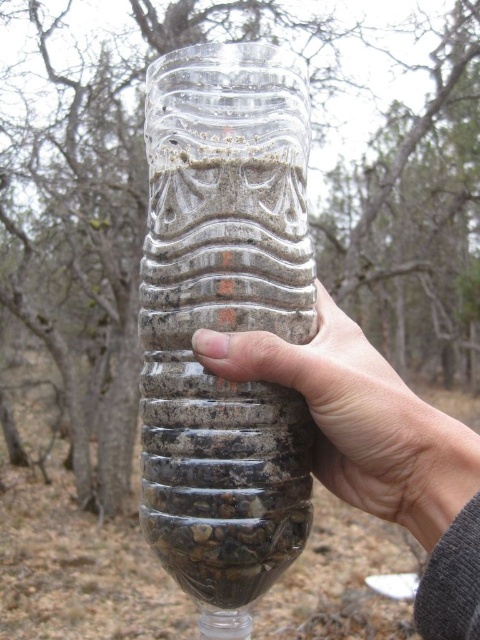
Question: Can you confirm if clear textured glass jar at center is wider than clear plastic bottle at center?

Choices:
 (A) no
 (B) yes

Answer: (A)

Question: In this image, where is clear textured glass jar at center located relative to clear plastic bottle at center?

Choices:
 (A) above
 (B) below

Answer: (A)

Question: Is clear textured glass jar at center closer to camera compared to clear plastic bottle at center?

Choices:
 (A) no
 (B) yes

Answer: (A)

Question: Which point is farther to the camera?

Choices:
 (A) (147, 272)
 (B) (434, 552)

Answer: (A)